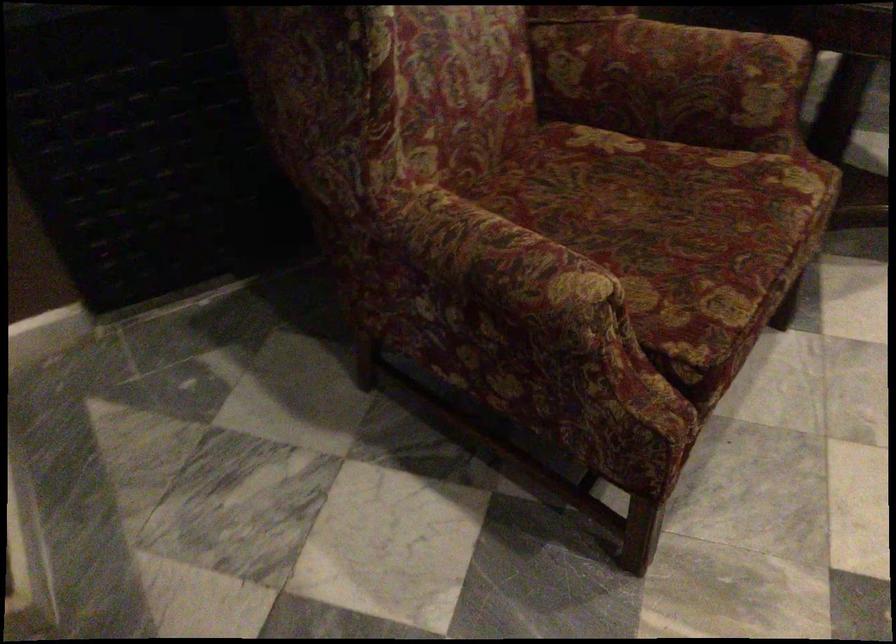
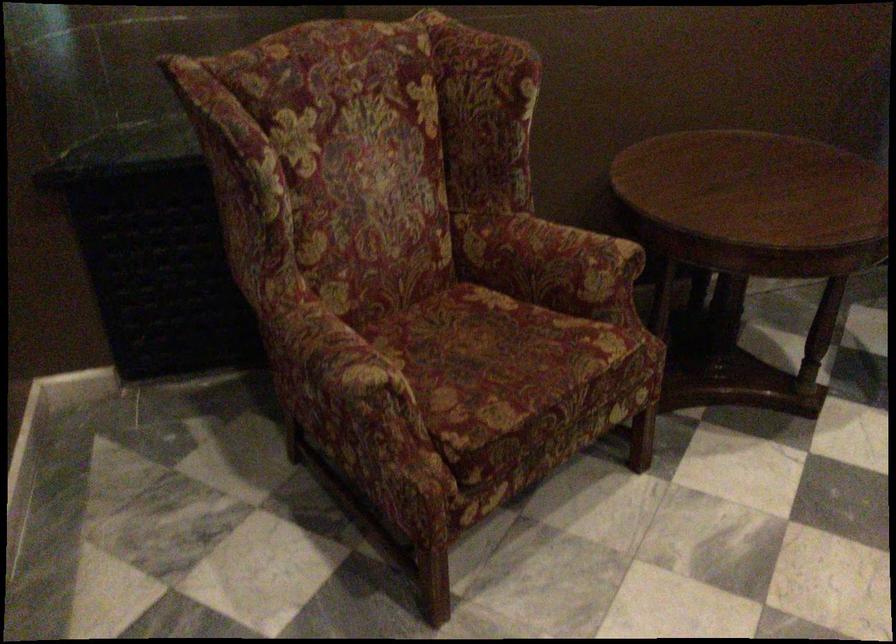
In the second image, find the point that corresponds to point (675, 234) in the first image.

(495, 363)